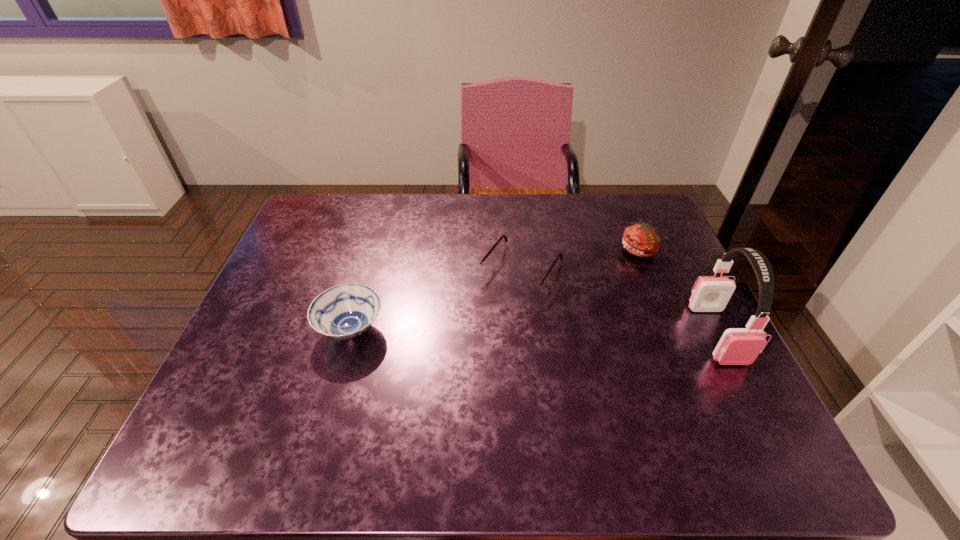
Locate an element on the screen. The width and height of the screenshot is (960, 540). free point between the tallest object and the soup bowl is located at coordinates (534, 332).

Locate an element on the screen. unoccupied position between the third object from right to left and the tomato is located at coordinates click(x=581, y=260).

Where is `empty space between the second tallest object and the third object from right to left`? empty space between the second tallest object and the third object from right to left is located at coordinates (581, 260).

Where is `free point between the spectacles and the second shortest object`? free point between the spectacles and the second shortest object is located at coordinates (436, 300).

The width and height of the screenshot is (960, 540). I want to click on vacant area that lies between the tallest object and the spectacles, so click(619, 302).

Locate an element on the screen. Image resolution: width=960 pixels, height=540 pixels. the second closest object to the third tallest object is located at coordinates (641, 239).

The height and width of the screenshot is (540, 960). What are the coordinates of `object that ranks as the third closest to the earphone` in the screenshot? It's located at (345, 311).